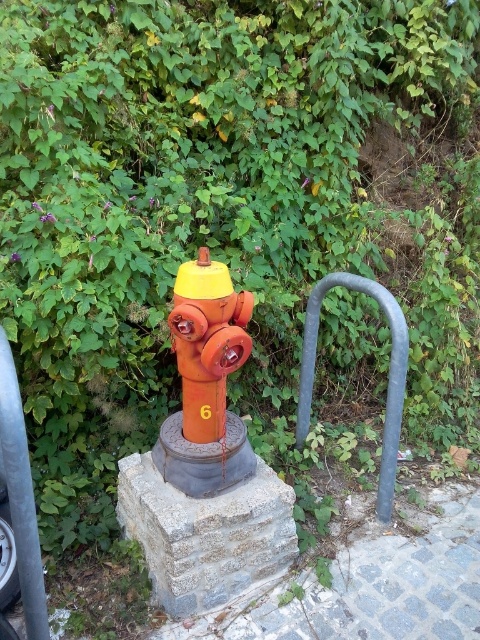
Is point (15, 486) positioned behind point (384, 470)?

No, (15, 486) is in front of (384, 470).

You are a GUI agent. You are given a task and a screenshot of the screen. Output one action in this format:
    pyautogui.click(x=<x>, y=<y>)
    Task: Click on the brushed metal rail at left
    Image resolution: width=480 pixels, height=640 pixels.
    Given the screenshot: What is the action you would take?
    pyautogui.click(x=21, y=496)

Measure the distance from matte orange fire hydrant at center to metallic gray rail at center right.

matte orange fire hydrant at center is 23.49 inches from metallic gray rail at center right.

Who is more forward, [216,316] or [389,412]?

Positioned in front is point [216,316].

Does point (196, 442) come farther from viewer compared to point (308, 305)?

No, (196, 442) is in front of (308, 305).

Locate an element on the screen. The height and width of the screenshot is (640, 480). matte orange fire hydrant at center is located at coordinates (206, 340).

Can you confirm if matte orange fire hydrant at center is positioned below brushed metal rail at left?

No, matte orange fire hydrant at center is not below brushed metal rail at left.

Is matte orange fire hydrant at center shorter than brushed metal rail at left?

Indeed, matte orange fire hydrant at center has a lesser height compared to brushed metal rail at left.

Which is behind, point (188, 422) or point (31, 484)?

Point (188, 422)

What are the coordinates of `matte orange fire hydrant at center` in the screenshot? It's located at (206, 340).